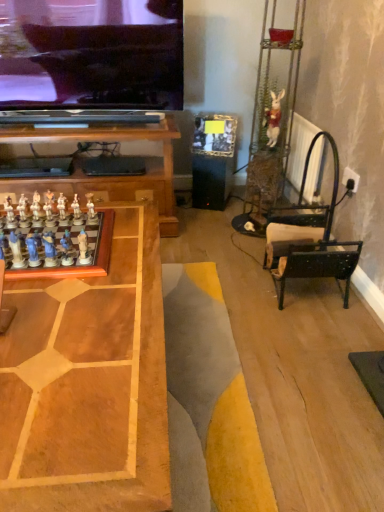
Find the location of a particular element. The image size is (384, 512). empty space that is to the right of white glossy chess set at lower left is located at coordinates (129, 252).